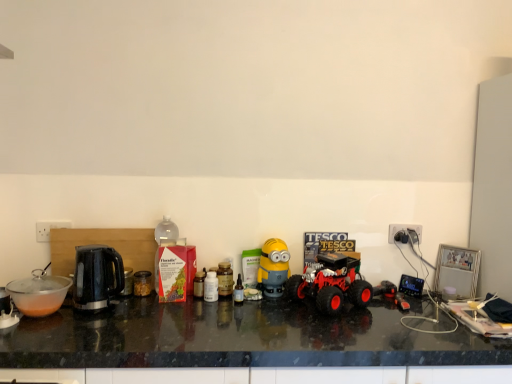
Question: From a real-world perspective, is translucent plastic bottle at center, arranged as the 3th bottle when viewed from the left, on yellow matte minion at center, arranged as the 2th toy when viewed from the right?

Choices:
 (A) yes
 (B) no

Answer: (B)

Question: Is translucent plastic bottle at center, arranged as the 3th bottle when viewed from the left, at the left side of yellow matte minion at center, acting as the 1th toy starting from the left?

Choices:
 (A) yes
 (B) no

Answer: (A)

Question: Does translucent plastic bottle at center, arranged as the 3th bottle when viewed from the left, have a greater width compared to yellow matte minion at center, acting as the 1th toy starting from the left?

Choices:
 (A) yes
 (B) no

Answer: (B)

Question: Is translucent plastic bottle at center, arranged as the 3th bottle when viewed from the left, completely or partially outside of yellow matte minion at center, arranged as the 2th toy when viewed from the right?

Choices:
 (A) no
 (B) yes

Answer: (B)

Question: Is translucent plastic bottle at center, arranged as the 3th bottle when viewed from the left, smaller than yellow matte minion at center, arranged as the 2th toy when viewed from the right?

Choices:
 (A) no
 (B) yes

Answer: (B)

Question: Is black plastic power outlet at right in front of or behind rubberized red toy truck at center in the image?

Choices:
 (A) behind
 (B) front

Answer: (A)

Question: Based on their sizes in the image, would you say black plastic power outlet at right is bigger or smaller than rubberized red toy truck at center?

Choices:
 (A) big
 (B) small

Answer: (B)

Question: Is black plastic power outlet at right wider or thinner than rubberized red toy truck at center?

Choices:
 (A) wide
 (B) thin

Answer: (B)

Question: Is black plastic power outlet at right situated inside rubberized red toy truck at center or outside?

Choices:
 (A) outside
 (B) inside

Answer: (A)

Question: Does point (223, 264) appear closer or farther from the camera than point (104, 281)?

Choices:
 (A) farther
 (B) closer

Answer: (A)

Question: Is translucent plastic bottle at center, which ranks as the 2th bottle in left-to-right order, taller or shorter than black plastic kettle at left?

Choices:
 (A) short
 (B) tall

Answer: (A)

Question: Considering the positions of translucent plastic bottle at center, which is the second bottle in right-to-left order, and black plastic kettle at left in the image, is translucent plastic bottle at center, which is the second bottle in right-to-left order, bigger or smaller than black plastic kettle at left?

Choices:
 (A) small
 (B) big

Answer: (A)

Question: Is translucent plastic bottle at center, which ranks as the 2th bottle in left-to-right order, wider or thinner than black plastic kettle at left?

Choices:
 (A) thin
 (B) wide

Answer: (A)

Question: Is black granite countertop at center spatially inside rubberized red toy truck at center, or outside of it?

Choices:
 (A) inside
 (B) outside

Answer: (B)

Question: In terms of size, does black granite countertop at center appear bigger or smaller than rubberized red toy truck at center?

Choices:
 (A) small
 (B) big

Answer: (B)